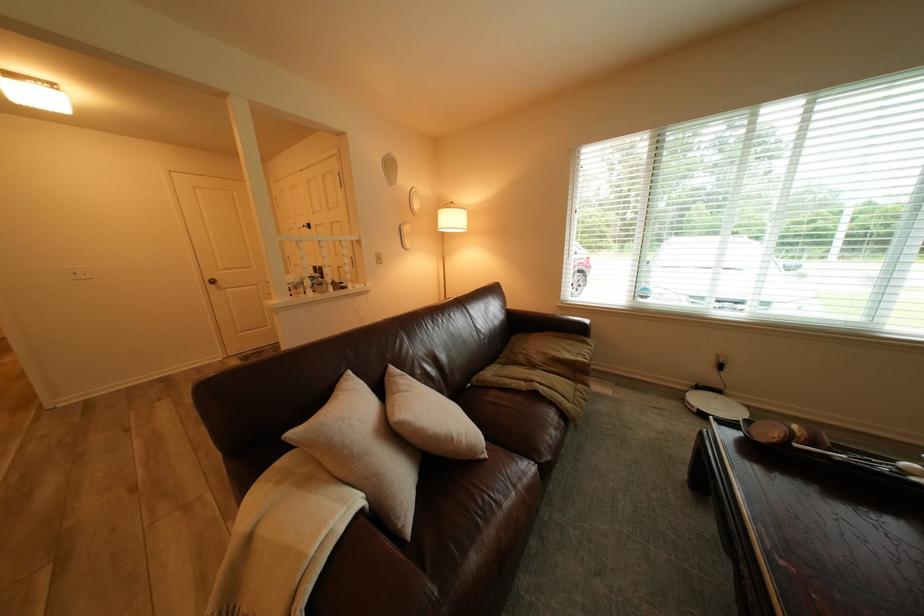
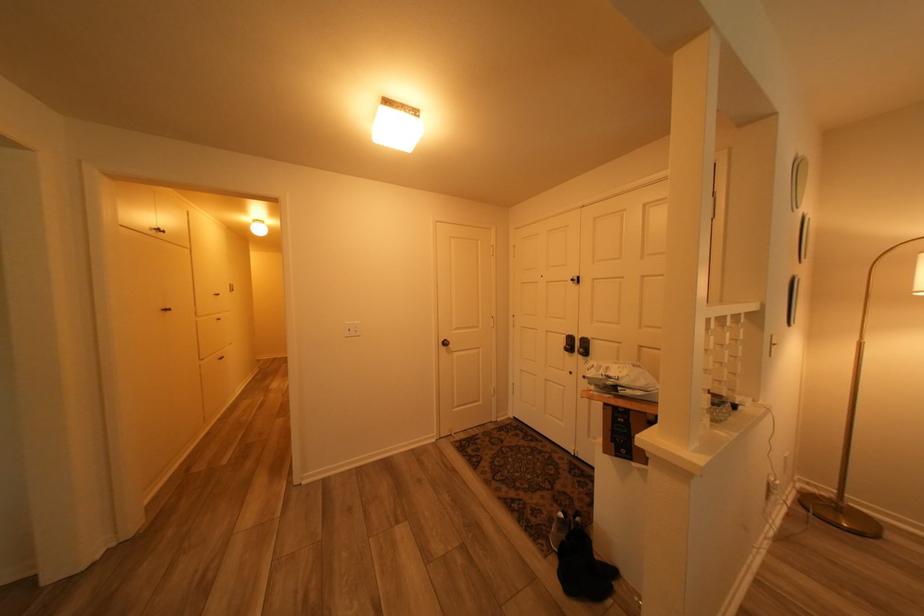
What movement of the cameraman would produce the second image?

The cameraman moved toward left, forward.